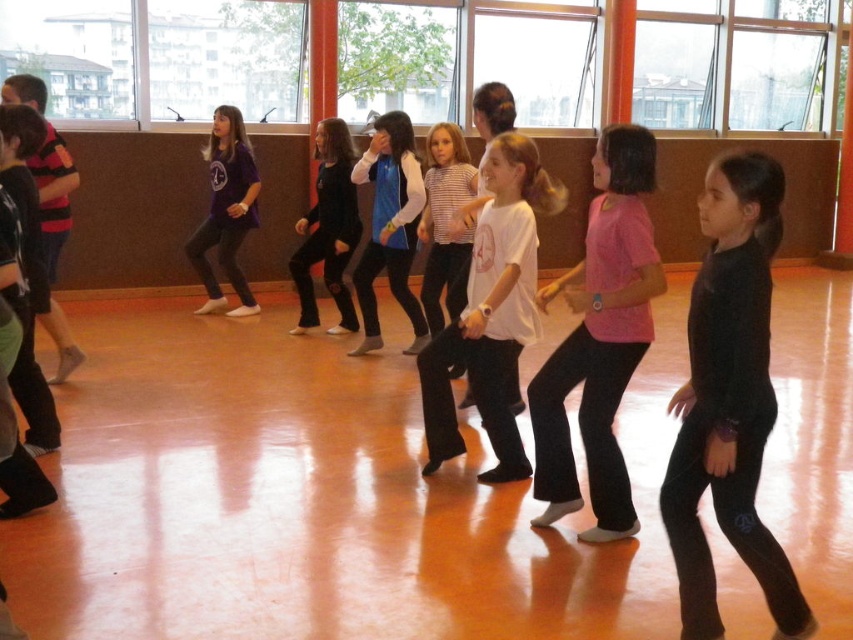
You are a photographer setting up a camera in the dance class. You need to focus on both the black matte pants at center and the matte purple shirt at center. Which object should you adjust your camera settings for first if you want to ensure both are in focus, considering their sizes?

The black matte pants at center occupies less space than the matte purple shirt at center, so you should adjust your camera settings for the matte purple shirt at center first to ensure proper focus on the larger object.

From the picture: You are a photographer standing at the entrance of the dance studio. You need to capture a photo that includes both the black matte leggings at right and the black matte pants at center. Given that your camera has a maximum focal length that allows capturing objects up to 5 meters apart in the same frame, will you be able to include both in a single shot?

The black matte leggings at right and black matte pants at center are 4.92 meters apart from each other. Since 4.92 meters is less than the maximum 5 meters your camera can capture, you can include both in a single shot.